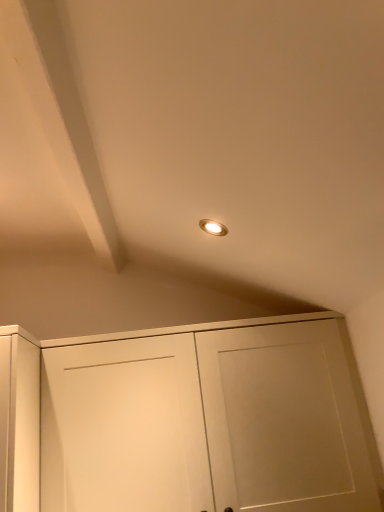
Measure the distance between white matte cabinet at center and camera.

A distance of 1.19 meters exists between white matte cabinet at center and camera.

At what (x,y) coordinates should I click in order to perform the action: click on white matte cabinet at center. Please return your answer as a coordinate pair (x, y). Looking at the image, I should click on (188, 420).

The image size is (384, 512). Describe the element at coordinates (188, 420) in the screenshot. I see `white matte cabinet at center` at that location.

Measure the distance between point (30, 27) and camera.

Point (30, 27) and camera are 32.17 inches apart from each other.

The width and height of the screenshot is (384, 512). Identify the location of matte white exhaust hood at upper left. (65, 121).

This screenshot has height=512, width=384. What do you see at coordinates (65, 121) in the screenshot? I see `matte white exhaust hood at upper left` at bounding box center [65, 121].

Image resolution: width=384 pixels, height=512 pixels. I want to click on white matte cabinet at center, so click(188, 420).

Is matte white exhaust hood at upper left to the right of white matte cabinet at center from the viewer's perspective?

No, matte white exhaust hood at upper left is not to the right of white matte cabinet at center.

Is matte white exhaust hood at upper left in front of white matte cabinet at center?

That is True.

Is point (93, 224) more distant than point (143, 373)?

Yes, it is.

From the image's perspective, is matte white exhaust hood at upper left on white matte cabinet at center?

Yes, from the image's perspective, matte white exhaust hood at upper left is on top of white matte cabinet at center.

From a real-world perspective, is matte white exhaust hood at upper left over white matte cabinet at center?

Yes.

Considering the sizes of objects matte white exhaust hood at upper left and white matte cabinet at center in the image provided, who is wider, matte white exhaust hood at upper left or white matte cabinet at center?

matte white exhaust hood at upper left is wider.

Considering the sizes of objects matte white exhaust hood at upper left and white matte cabinet at center in the image provided, who is shorter, matte white exhaust hood at upper left or white matte cabinet at center?

matte white exhaust hood at upper left is shorter.

From the picture: Between matte white exhaust hood at upper left and white matte cabinet at center, which one has larger size?

white matte cabinet at center.

Is matte white exhaust hood at upper left situated inside white matte cabinet at center or outside?

The correct answer is: outside.

In the scene shown: Are matte white exhaust hood at upper left and white matte cabinet at center beside each other?

No, matte white exhaust hood at upper left is not touching white matte cabinet at center.

Is matte white exhaust hood at upper left oriented away from white matte cabinet at center?

matte white exhaust hood at upper left does not have its back to white matte cabinet at center.

I want to click on exhaust hood positioned vertically above the white matte cabinet at center (from a real-world perspective), so [x=65, y=121].

Considering the relative positions of white matte cabinet at center and matte white exhaust hood at upper left in the image provided, is white matte cabinet at center to the left or to the right of matte white exhaust hood at upper left?

Based on their positions, white matte cabinet at center is located to the right of matte white exhaust hood at upper left.

Is white matte cabinet at center positioned before matte white exhaust hood at upper left?

No, white matte cabinet at center is behind matte white exhaust hood at upper left.

Is point (200, 439) positioned behind point (94, 205)?

No.

From the image's perspective, is white matte cabinet at center above or below matte white exhaust hood at upper left?

white matte cabinet at center is situated lower than matte white exhaust hood at upper left in the image.

From a real-world perspective, relative to matte white exhaust hood at upper left, is white matte cabinet at center vertically above or below?

white matte cabinet at center is situated lower than matte white exhaust hood at upper left in the real world.

Between white matte cabinet at center and matte white exhaust hood at upper left, which one has smaller width?

Thinner between the two is white matte cabinet at center.

Is white matte cabinet at center taller or shorter than matte white exhaust hood at upper left?

Clearly, white matte cabinet at center is taller compared to matte white exhaust hood at upper left.

Is white matte cabinet at center smaller than matte white exhaust hood at upper left?

Incorrect, white matte cabinet at center is not smaller in size than matte white exhaust hood at upper left.

Consider the image. Is white matte cabinet at center completely or partially outside of matte white exhaust hood at upper left?

Yes, white matte cabinet at center is not within matte white exhaust hood at upper left.

Is white matte cabinet at center positioned far away from matte white exhaust hood at upper left?

No, white matte cabinet at center is not far from matte white exhaust hood at upper left.

Could you tell me if white matte cabinet at center is turned towards matte white exhaust hood at upper left?

No, white matte cabinet at center is not turned towards matte white exhaust hood at upper left.

How far apart are white matte cabinet at center and matte white exhaust hood at upper left?

white matte cabinet at center is 31.69 inches away from matte white exhaust hood at upper left.

Where is `cupboard behind the matte white exhaust hood at upper left`? Image resolution: width=384 pixels, height=512 pixels. cupboard behind the matte white exhaust hood at upper left is located at coordinates (188, 420).

Locate an element on the screen. This screenshot has width=384, height=512. cupboard that appears on the right of matte white exhaust hood at upper left is located at coordinates (188, 420).

What are the coordinates of `cupboard behind the matte white exhaust hood at upper left` in the screenshot? It's located at (188, 420).